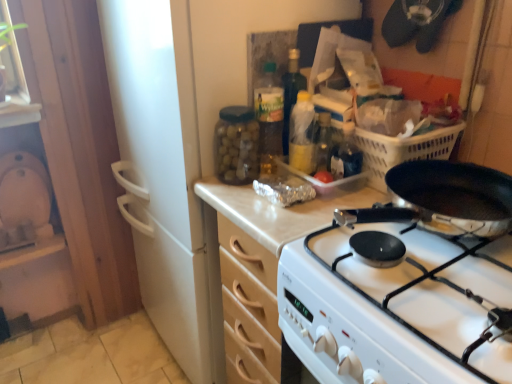
Question: From a real-world perspective, is white glossy gas stove at center physically located above or below clear plastic container at center?

Choices:
 (A) below
 (B) above

Answer: (A)

Question: Based on their sizes in the image, would you say white glossy gas stove at center is bigger or smaller than clear plastic container at center?

Choices:
 (A) big
 (B) small

Answer: (A)

Question: Estimate the real-world distances between objects in this image. Which object is farther from the transparent glass jar at upper center, which is the third bottle from right to left?

Choices:
 (A) white glossy gas stove at center
 (B) clear plastic container at center
 (C) translucent plastic bottle at center, placed as the second bottle when sorted from left to right
 (D) translucent plastic bottle at center, acting as the 1th bottle starting from the right
 (E) wooden cabinet at center

Answer: (A)

Question: Which is farther from the translucent plastic bottle at center, acting as the third bottle starting from the left?

Choices:
 (A) translucent plastic bottle at center, placed as the second bottle when sorted from left to right
 (B) wooden cabinet at center
 (C) transparent glass jar at upper center, which is the third bottle from right to left
 (D) white glossy gas stove at center
 (E) clear plastic container at center

Answer: (D)